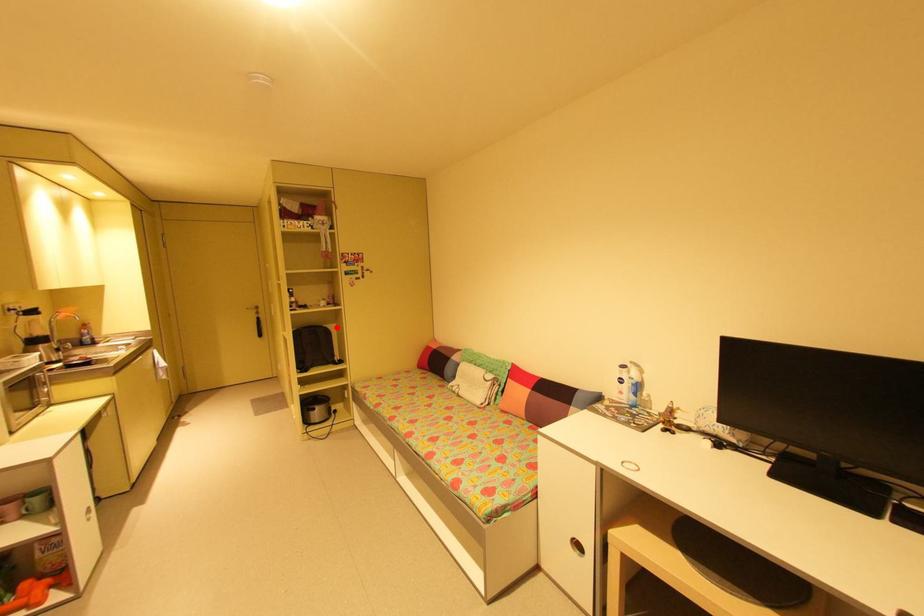
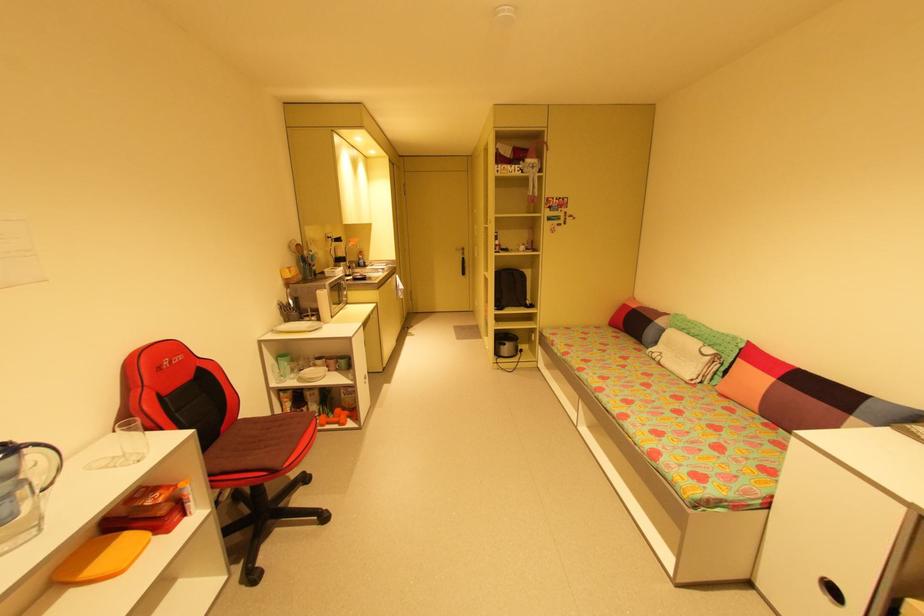
In the second image, find the point that corresponds to the highlighted location in the first image.

(532, 273)